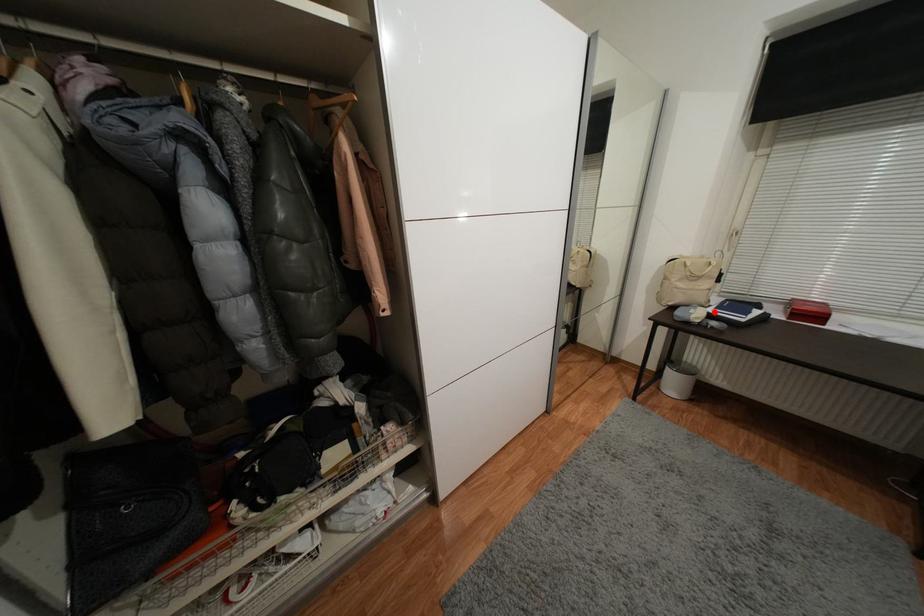
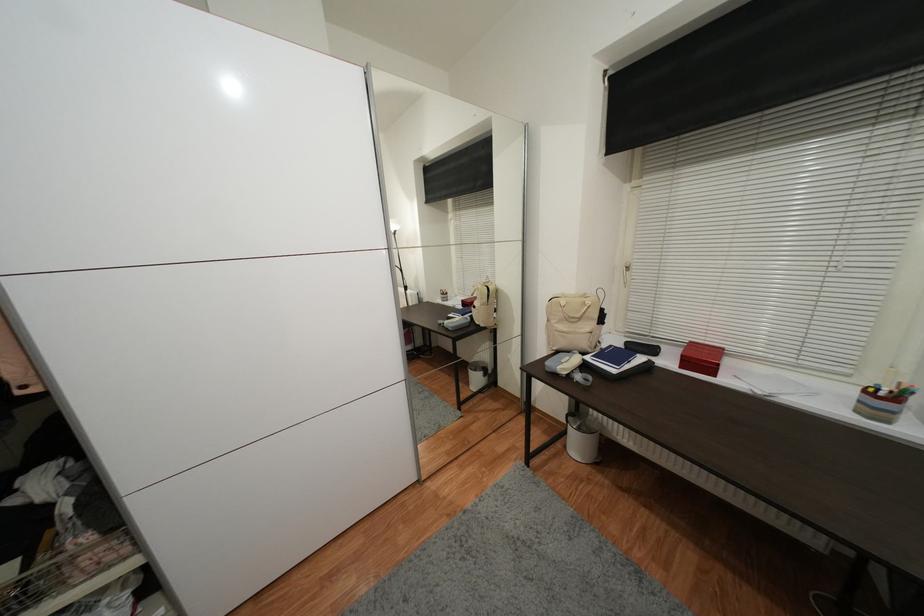
Find the pixel in the second image that matches the highlighted location in the first image.

(592, 360)